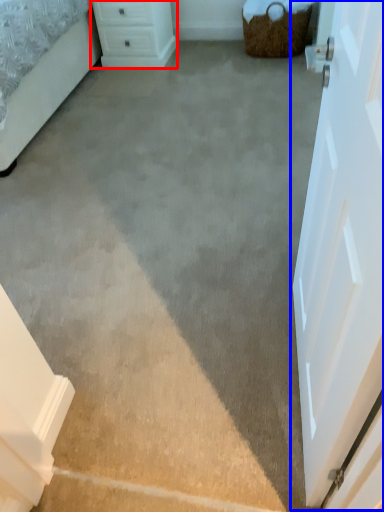
Question: Which object appears farthest to the camera in this image, chest of drawers (highlighted by a red box) or door (highlighted by a blue box)?

Choices:
 (A) chest of drawers
 (B) door

Answer: (A)